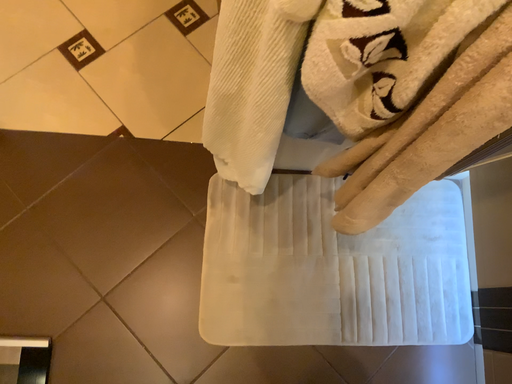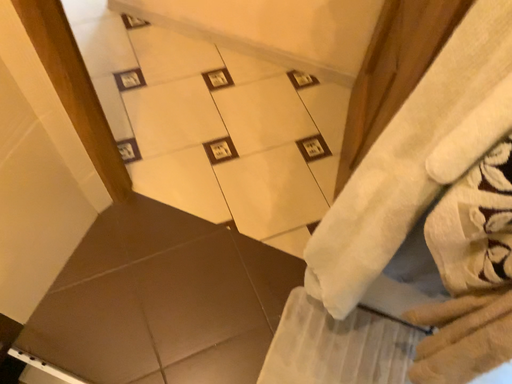
Question: How did the camera likely rotate when shooting the video?

Choices:
 (A) rotated right
 (B) rotated left

Answer: (B)